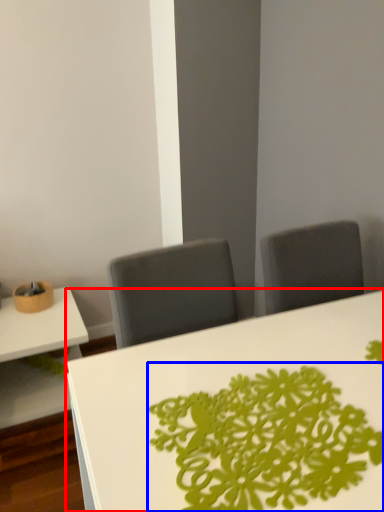
Question: Which object appears closest to the camera in this image, table (highlighted by a red box) or floral arrangement (highlighted by a blue box)?

Choices:
 (A) table
 (B) floral arrangement

Answer: (A)